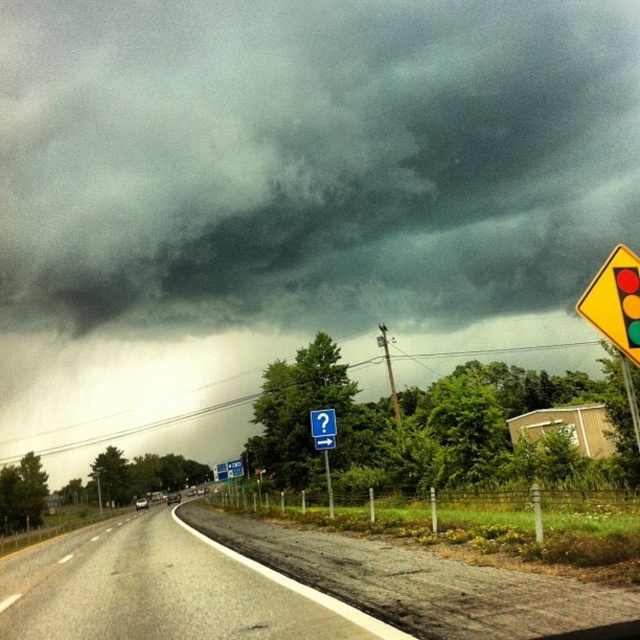
Does yellow plastic traffic light at right have a lesser height compared to blue plastic sign at center?

Incorrect, yellow plastic traffic light at right's height does not fall short of blue plastic sign at center's.

Does point (588, 312) come behind point (328, 433)?

No.

Is point (604, 304) farther from camera compared to point (324, 424)?

No, it is not.

At what (x,y) coordinates should I click in order to perform the action: click on yellow plastic traffic light at right. Please return your answer as a coordinate pair (x, y). The image size is (640, 640). Looking at the image, I should click on (616, 301).

Does asphalt road at lower left have a greater width compared to brushed metal signpost at center?

Indeed, asphalt road at lower left has a greater width compared to brushed metal signpost at center.

Is point (180, 625) more distant than point (326, 474)?

No, (180, 625) is closer to viewer.

You are a GUI agent. You are given a task and a screenshot of the screen. Output one action in this format:
    pyautogui.click(x=<x>, y=<y>)
    Task: Click on the asphalt road at lower left
    
    Given the screenshot: What is the action you would take?
    pyautogui.click(x=163, y=589)

You are a GUI agent. You are given a task and a screenshot of the screen. Output one action in this format:
    pyautogui.click(x=<x>, y=<y>)
    Task: Click on the asphalt road at lower left
    The image size is (640, 640).
    Given the screenshot: What is the action you would take?
    pyautogui.click(x=163, y=589)

Is asphalt road at lower left to the right of blue plastic sign at center from the viewer's perspective?

No, asphalt road at lower left is not to the right of blue plastic sign at center.

Is point (332, 620) farther from camera compared to point (324, 440)?

No, it is not.

At what (x,y) coordinates should I click in order to perform the action: click on asphalt road at lower left. Please return your answer as a coordinate pair (x, y). The height and width of the screenshot is (640, 640). Looking at the image, I should click on (163, 589).